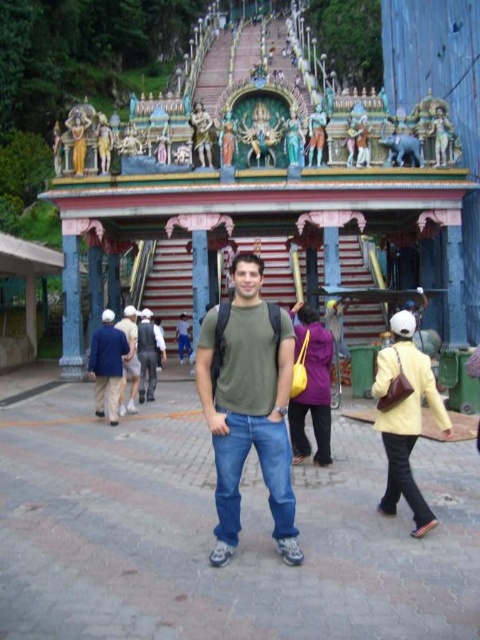
The image size is (480, 640). Describe the element at coordinates (108, 365) in the screenshot. I see `dark blue jeans at center` at that location.

Can you confirm if dark blue jeans at center is positioned to the left of light brown leather backpack at center?

Correct, you'll find dark blue jeans at center to the left of light brown leather backpack at center.

Measure the distance between point (103, 324) and camera.

A distance of 218.20 feet exists between point (103, 324) and camera.

I want to click on dark blue jeans at center, so click(108, 365).

Who is taller, green matte t-shirt at center or yellow leather jacket at center?

With more height is green matte t-shirt at center.

The image size is (480, 640). Describe the element at coordinates (249, 408) in the screenshot. I see `green matte t-shirt at center` at that location.

At what (x,y) coordinates should I click in order to perform the action: click on green matte t-shirt at center. Please return your answer as a coordinate pair (x, y). The width and height of the screenshot is (480, 640). Looking at the image, I should click on (249, 408).

Can you confirm if dark gray jeans at center is shorter than light brown leather backpack at center?

Correct, dark gray jeans at center is not as tall as light brown leather backpack at center.

Is dark gray jeans at center to the left of light brown leather backpack at center from the viewer's perspective?

In fact, dark gray jeans at center is to the right of light brown leather backpack at center.

Does point (152, 392) come behind point (133, 348)?

Yes, it is behind point (133, 348).

You are a GUI agent. You are given a task and a screenshot of the screen. Output one action in this format:
    pyautogui.click(x=<x>, y=<y>)
    Task: Click on the dark gray jeans at center
    The image size is (480, 640).
    Given the screenshot: What is the action you would take?
    pyautogui.click(x=147, y=355)